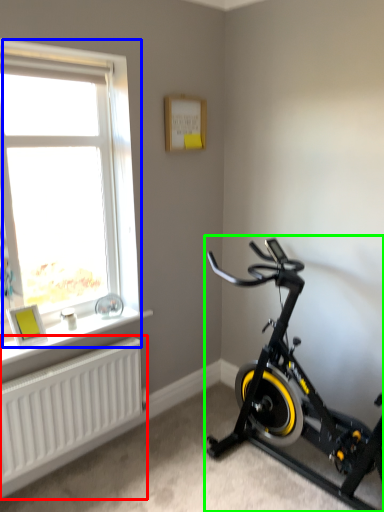
Question: Considering the real-world distances, which object is farthest from radiator (highlighted by a red box)? window (highlighted by a blue box) or stationary bicycle (highlighted by a green box)?

Choices:
 (A) window
 (B) stationary bicycle

Answer: (B)